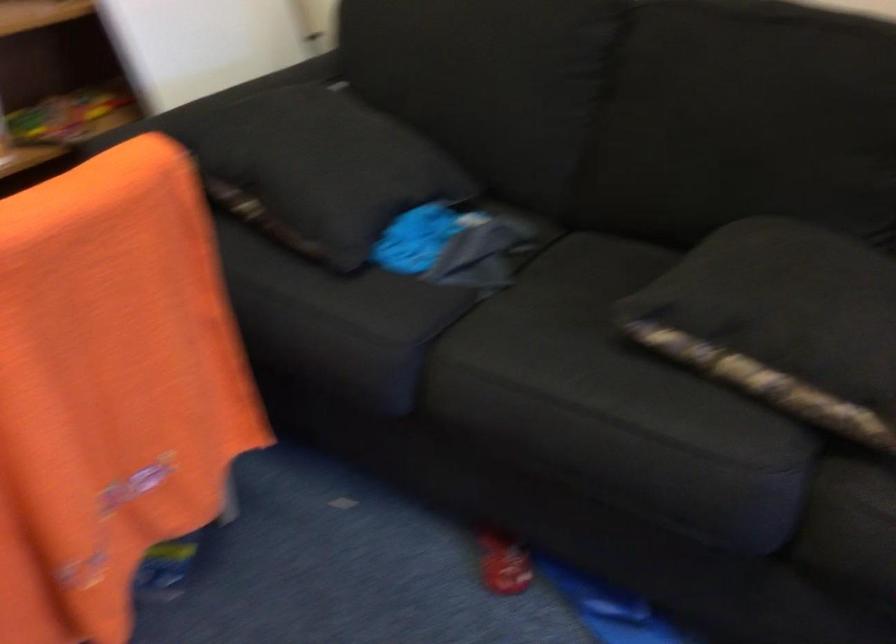
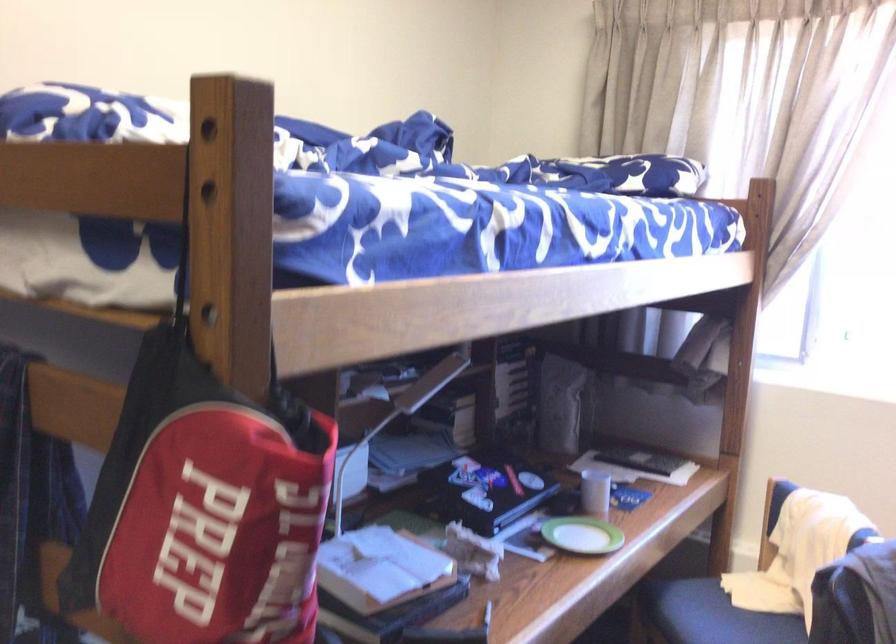
Question: The camera is either moving clockwise (left) or counter-clockwise (right) around the object. The first image is from the beginning of the video and the second image is from the end. Is the camera moving left or right when shooting the video?

Choices:
 (A) Left
 (B) Right

Answer: (A)